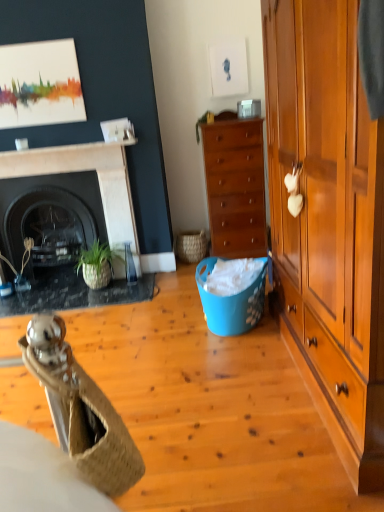
The height and width of the screenshot is (512, 384). What do you see at coordinates (74, 294) in the screenshot?
I see `matte black fireplace at left` at bounding box center [74, 294].

In order to face woven brown picnic basket at center, should I rotate leftwards or rightwards?

It's best to rotate left around 0.019 degrees.

This screenshot has width=384, height=512. I want to click on wooden cabinet at right, so pyautogui.click(x=329, y=221).

What do you see at coordinates (231, 302) in the screenshot? I see `blue plastic laundry basket at center` at bounding box center [231, 302].

At what (x,y) coordinates should I click in order to perform the action: click on matte white coffee cup at upper left. Please return your answer as a coordinate pair (x, y). Looking at the image, I should click on (21, 144).

Considering the sizes of objects matte white coffee cup at upper left and woven straw chair at lower left in the image provided, who is thinner, matte white coffee cup at upper left or woven straw chair at lower left?

matte white coffee cup at upper left is thinner.

I want to click on coffee cup that is above the woven straw chair at lower left (from a real-world perspective), so click(21, 144).

Does matte white coffee cup at upper left have a greater height compared to woven straw chair at lower left?

In fact, matte white coffee cup at upper left may be shorter than woven straw chair at lower left.

Is matte white coffee cup at upper left far away from woven straw chair at lower left?

Indeed, matte white coffee cup at upper left is not near woven straw chair at lower left.

From the image's perspective, is black glossy fireplace at left, acting as the first fireplace starting from the back, above or below brown wooden dresser at center?

Based on their image positions, black glossy fireplace at left, acting as the first fireplace starting from the back, is located beneath brown wooden dresser at center.

Is black glossy fireplace at left, which is counted as the 2th fireplace, starting from the front, not inside brown wooden dresser at center?

Absolutely, black glossy fireplace at left, which is counted as the 2th fireplace, starting from the front, is external to brown wooden dresser at center.

Is black glossy fireplace at left, which is counted as the 2th fireplace, starting from the front, aimed at brown wooden dresser at center?

No, black glossy fireplace at left, which is counted as the 2th fireplace, starting from the front, does not turn towards brown wooden dresser at center.

From a real-world perspective, is black glossy fireplace at left, acting as the first fireplace starting from the back, below brown wooden dresser at center?

Yes.

Is green leafy plant at upper center wider than woven straw chair at lower left?

No, green leafy plant at upper center is not wider than woven straw chair at lower left.

Identify the location of plant located on the right of woven straw chair at lower left. (203, 122).

Is green leafy plant at upper center turned away from woven straw chair at lower left?

green leafy plant at upper center does not have its back to woven straw chair at lower left.

Which object is closer to the camera taking this photo, green leafy plant at upper center or woven straw chair at lower left?

woven straw chair at lower left is more forward.

Does black marble fireplace at left, the second fireplace from the back, turn towards black glossy fireplace at left, acting as the first fireplace starting from the back?

Yes, black marble fireplace at left, the second fireplace from the back, is aimed at black glossy fireplace at left, acting as the first fireplace starting from the back.

In the scene shown: Does black marble fireplace at left, the second fireplace from the back, have a larger size compared to black glossy fireplace at left, acting as the first fireplace starting from the back?

Actually, black marble fireplace at left, the second fireplace from the back, might be smaller than black glossy fireplace at left, acting as the first fireplace starting from the back.

Locate an element on the screen. fireplace that is in front of the black glossy fireplace at left, acting as the first fireplace starting from the back is located at coordinates tap(82, 170).

In the scene shown: From a real-world perspective, which is physically below, black marble fireplace at left, the second fireplace from the back, or black glossy fireplace at left, acting as the first fireplace starting from the back?

In real-world perspective, black glossy fireplace at left, acting as the first fireplace starting from the back, is lower.

Can you confirm if woven straw chair at lower left is shorter than matte black fireplace at left?

In fact, woven straw chair at lower left may be taller than matte black fireplace at left.

Considering their positions, is woven straw chair at lower left located in front of or behind matte black fireplace at left?

woven straw chair at lower left is positioned closer to the viewer than matte black fireplace at left.

From a real-world perspective, is woven straw chair at lower left positioned over matte black fireplace at left based on gravity?

Yes, from a real-world perspective, woven straw chair at lower left is on top of matte black fireplace at left.

Between point (59, 378) and point (142, 292), which one is positioned behind?

The point (142, 292) is behind.

From a real-world perspective, which is physically below, satin silver phone at upper center or matte white coffee cup at upper left?

matte white coffee cup at upper left is physically lower.

Can you see satin silver phone at upper center touching matte white coffee cup at upper left?

They are not placed beside each other.

Considering their positions, is satin silver phone at upper center located in front of or behind matte white coffee cup at upper left?

satin silver phone at upper center is positioned farther from the viewer than matte white coffee cup at upper left.

Can you confirm if satin silver phone at upper center is positioned to the right of matte white coffee cup at upper left?

Yes.

Which object is positioned more to the left, green leafy plant at upper center or blue plastic laundry basket at center?

From the viewer's perspective, green leafy plant at upper center appears more on the left side.

Is blue plastic laundry basket at center at the back of green leafy plant at upper center?

No, green leafy plant at upper center is not facing away from blue plastic laundry basket at center.

Considering the sizes of objects green leafy plant at upper center and blue plastic laundry basket at center in the image provided, who is smaller, green leafy plant at upper center or blue plastic laundry basket at center?

green leafy plant at upper center is smaller.

Where is `coffee cup behind the woven straw chair at lower left`? This screenshot has height=512, width=384. coffee cup behind the woven straw chair at lower left is located at coordinates (21, 144).

Where is `cabinet lying on the right of black glossy fireplace at left, which is counted as the 2th fireplace, starting from the front`? The width and height of the screenshot is (384, 512). cabinet lying on the right of black glossy fireplace at left, which is counted as the 2th fireplace, starting from the front is located at coordinates (235, 187).

Looking at the image, which one is located further to blue plastic laundry basket at center, satin silver phone at upper center or woven straw chair at lower left?

Based on the image, woven straw chair at lower left appears to be further to blue plastic laundry basket at center.

Estimate the real-world distances between objects in this image. Which object is closer to black marble fireplace at left, positioned as the first fireplace in front-to-back order, matte white coffee cup at upper left or blue plastic laundry basket at center?

Among the two, matte white coffee cup at upper left is located nearer to black marble fireplace at left, positioned as the first fireplace in front-to-back order.

From the image, which object appears to be farther from matte black fireplace at left, blue plastic laundry basket at center or wooden cabinet at right?

The object further to matte black fireplace at left is wooden cabinet at right.

In the scene shown: From the image, which object appears to be nearer to brown wooden dresser at center, matte white coffee cup at upper left or matte black fireplace at left?

The object closer to brown wooden dresser at center is matte black fireplace at left.

When comparing their distances from wooden cabinet at right, does blue plastic laundry basket at center or matte black fireplace at left seem further?

Based on the image, matte black fireplace at left appears to be further to wooden cabinet at right.

When comparing their distances from wooden cabinet at right, does woven straw chair at lower left or matte black fireplace at left seem closer?

woven straw chair at lower left is positioned closer to the anchor wooden cabinet at right.

In the scene shown: Looking at the image, which one is located closer to matte black fireplace at left, black marble fireplace at left, the second fireplace from the back, or woven straw chair at lower left?

black marble fireplace at left, the second fireplace from the back, is closer to matte black fireplace at left.

Looking at the image, which one is located closer to matte black fireplace at left, matte white coffee cup at upper left or brown wooden dresser at center?

brown wooden dresser at center.

At what (x,y) coordinates should I click in order to perform the action: click on plant between matte white coffee cup at upper left and satin silver phone at upper center in the horizontal direction. Please return your answer as a coordinate pair (x, y). The width and height of the screenshot is (384, 512). Looking at the image, I should click on (203, 122).

I want to click on carpets between woven straw chair at lower left and green leafy plant at upper center from front to back, so click(x=74, y=294).

I want to click on cabinet between satin silver phone at upper center and woven brown picnic basket at center from top to bottom, so click(x=235, y=187).

At what (x,y) coordinates should I click in order to perform the action: click on fireplace between black glossy fireplace at left, which is counted as the 2th fireplace, starting from the front, and brown wooden dresser at center. Please return your answer as a coordinate pair (x, y). Image resolution: width=384 pixels, height=512 pixels. Looking at the image, I should click on (82, 170).